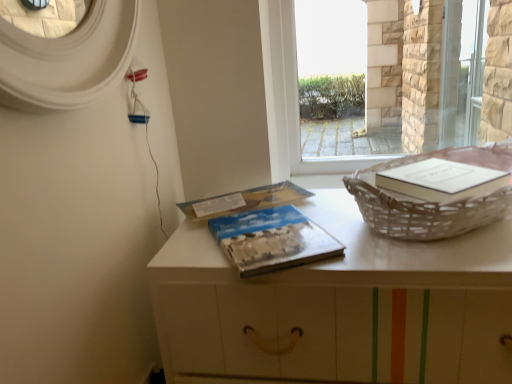
Locate an element on the screen. The width and height of the screenshot is (512, 384). blue matte paper at center, the 1th paperback book when ordered from back to front is located at coordinates (244, 201).

Describe the element at coordinates (340, 306) in the screenshot. I see `white matte table at center` at that location.

What do you see at coordinates (272, 240) in the screenshot?
I see `blue textured paper at center, marked as the second paperback book in a back-to-front arrangement` at bounding box center [272, 240].

The height and width of the screenshot is (384, 512). I want to click on woven wicker basket at right, so click(432, 203).

From the image's perspective, between blue textured paper at center, marked as the second paperback book in a back-to-front arrangement, and blue matte paper at center, which appears as the second paperback book when viewed from the front, which one is located above?

blue matte paper at center, which appears as the second paperback book when viewed from the front, appears higher in the image.

Visually, is blue textured paper at center, marked as the second paperback book in a back-to-front arrangement, positioned to the left or to the right of blue matte paper at center, the 1th paperback book when ordered from back to front?

In the image, blue textured paper at center, marked as the second paperback book in a back-to-front arrangement, appears on the right side of blue matte paper at center, the 1th paperback book when ordered from back to front.

Would you consider blue textured paper at center, marked as the second paperback book in a back-to-front arrangement, to be distant from blue matte paper at center, the 1th paperback book when ordered from back to front?

They are positioned close to each other.

Between blue textured paper at center, marked as the 1th paperback book in a front-to-back arrangement, and blue matte paper at center, which appears as the second paperback book when viewed from the front, which one has larger width?

blue textured paper at center, marked as the 1th paperback book in a front-to-back arrangement.

Based on the photo, which point is more distant from viewer, (413, 307) or (206, 213)?

The point (206, 213) is more distant.

From the image's perspective, is white matte table at center above or below blue matte paper at center, which appears as the second paperback book when viewed from the front?

white matte table at center is situated lower than blue matte paper at center, which appears as the second paperback book when viewed from the front, in the image.

Can you confirm if white matte table at center is taller than blue matte paper at center, the 1th paperback book when ordered from back to front?

Yes, white matte table at center is taller than blue matte paper at center, the 1th paperback book when ordered from back to front.

Looking at this image, would you say blue matte paper at center, the 1th paperback book when ordered from back to front, is part of white matte table at center's contents?

Yes, blue matte paper at center, the 1th paperback book when ordered from back to front, is a part of white matte table at center.

Consider the image. Is woven wicker basket at right in contact with transparent glass screen door at upper right?

No, woven wicker basket at right is not touching transparent glass screen door at upper right.

Is woven wicker basket at right looking in the opposite direction of transparent glass screen door at upper right?

Correct, woven wicker basket at right is looking away from transparent glass screen door at upper right.

From a real-world perspective, is woven wicker basket at right below transparent glass screen door at upper right?

Yes, from a real-world perspective, woven wicker basket at right is below transparent glass screen door at upper right.

Is blue textured paper at center, marked as the 1th paperback book in a front-to-back arrangement, not close to transparent glass window at center?

No, blue textured paper at center, marked as the 1th paperback book in a front-to-back arrangement, is in close proximity to transparent glass window at center.

What are the coordinates of `window behind the blue textured paper at center, marked as the second paperback book in a back-to-front arrangement` in the screenshot? It's located at (290, 99).

Does blue textured paper at center, marked as the second paperback book in a back-to-front arrangement, turn towards transparent glass window at center?

No, blue textured paper at center, marked as the second paperback book in a back-to-front arrangement, does not turn towards transparent glass window at center.

Considering the relative sizes of blue textured paper at center, marked as the 1th paperback book in a front-to-back arrangement, and transparent glass window at center in the image provided, is blue textured paper at center, marked as the 1th paperback book in a front-to-back arrangement, thinner than transparent glass window at center?

Incorrect, the width of blue textured paper at center, marked as the 1th paperback book in a front-to-back arrangement, is not less than that of transparent glass window at center.

Considering the sizes of objects blue textured paper at center, marked as the 1th paperback book in a front-to-back arrangement, and white matte table at center in the image provided, who is wider, blue textured paper at center, marked as the 1th paperback book in a front-to-back arrangement, or white matte table at center?

white matte table at center.

Based on the photo, how many degrees apart are the facing directions of blue textured paper at center, marked as the 1th paperback book in a front-to-back arrangement, and white matte table at center?

The angular difference between blue textured paper at center, marked as the 1th paperback book in a front-to-back arrangement, and white matte table at center is 32.7 degrees.

Is blue textured paper at center, marked as the second paperback book in a back-to-front arrangement, inside the boundaries of white matte table at center, or outside?

blue textured paper at center, marked as the second paperback book in a back-to-front arrangement, is spatially positioned inside white matte table at center.

How many degrees apart are the facing directions of blue textured paper at center, marked as the second paperback book in a back-to-front arrangement, and transparent glass screen door at upper right?

The angular difference between blue textured paper at center, marked as the second paperback book in a back-to-front arrangement, and transparent glass screen door at upper right is 33.8 degrees.

Considering the relative sizes of blue textured paper at center, marked as the 1th paperback book in a front-to-back arrangement, and transparent glass screen door at upper right in the image provided, is blue textured paper at center, marked as the 1th paperback book in a front-to-back arrangement, taller than transparent glass screen door at upper right?

In fact, blue textured paper at center, marked as the 1th paperback book in a front-to-back arrangement, may be shorter than transparent glass screen door at upper right.

This screenshot has width=512, height=384. I want to click on paperback book that is the 2nd one when counting downward from the transparent glass screen door at upper right (from the image's perspective), so click(x=272, y=240).

Between blue textured paper at center, marked as the second paperback book in a back-to-front arrangement, and transparent glass screen door at upper right, which one has larger size?

Bigger between the two is transparent glass screen door at upper right.

From the image's perspective, is woven wicker basket at right located beneath white matte table at center?

Incorrect, from the image's perspective, woven wicker basket at right is higher than white matte table at center.

Considering the positions of points (507, 193) and (502, 229), is point (507, 193) closer to camera compared to point (502, 229)?

Yes.

Does woven wicker basket at right appear on the left side of white matte table at center?

No, woven wicker basket at right is not to the left of white matte table at center.

Could you tell me if woven wicker basket at right is turned towards white matte table at center?

No.

At what (x,y) coordinates should I click in order to perform the action: click on paperback book in front of the blue matte paper at center, which appears as the second paperback book when viewed from the front. Please return your answer as a coordinate pair (x, y). The height and width of the screenshot is (384, 512). Looking at the image, I should click on (272, 240).

Where is `the 2nd paperback book above when counting from the white matte table at center (from the image's perspective)`? the 2nd paperback book above when counting from the white matte table at center (from the image's perspective) is located at coordinates (244, 201).

Based on their spatial positions, is white matte table at center or blue textured paper at center, marked as the second paperback book in a back-to-front arrangement, further from transparent glass window at center?

Among the two, white matte table at center is located further to transparent glass window at center.

Looking at the image, which one is located closer to transparent glass screen door at upper right, transparent glass window at center or blue textured paper at center, marked as the 1th paperback book in a front-to-back arrangement?

transparent glass window at center is positioned closer to the anchor transparent glass screen door at upper right.

When comparing their distances from white matte table at center, does blue matte paper at center, the 1th paperback book when ordered from back to front, or woven wicker basket at right seem further?

blue matte paper at center, the 1th paperback book when ordered from back to front, lies further to white matte table at center than the other object.

Which object lies nearer to the anchor point blue matte paper at center, the 1th paperback book when ordered from back to front, woven wicker basket at right or transparent glass screen door at upper right?

The object closer to blue matte paper at center, the 1th paperback book when ordered from back to front, is woven wicker basket at right.

From the image, which object appears to be farther from transparent glass window at center, white matte table at center or blue matte paper at center, which appears as the second paperback book when viewed from the front?

white matte table at center is further to transparent glass window at center.

Considering their positions, is white matte table at center positioned closer to transparent glass screen door at upper right than transparent glass window at center?

transparent glass window at center is positioned closer to the anchor transparent glass screen door at upper right.

Looking at the image, which one is located further to blue textured paper at center, marked as the 1th paperback book in a front-to-back arrangement, blue matte paper at center, the 1th paperback book when ordered from back to front, or transparent glass window at center?

transparent glass window at center is positioned further to the anchor blue textured paper at center, marked as the 1th paperback book in a front-to-back arrangement.

Looking at this image, when comparing their distances from transparent glass window at center, does woven wicker basket at right or transparent glass screen door at upper right seem further?

transparent glass screen door at upper right is further to transparent glass window at center.

Where is `paperback book between blue matte paper at center, the 1th paperback book when ordered from back to front, and white matte table at center in the up-down direction`? The image size is (512, 384). paperback book between blue matte paper at center, the 1th paperback book when ordered from back to front, and white matte table at center in the up-down direction is located at coordinates (272, 240).

Locate an element on the screen. Image resolution: width=512 pixels, height=384 pixels. window located between white matte table at center and transparent glass screen door at upper right in the depth direction is located at coordinates (290, 99).

In order to click on paperback book situated between blue matte paper at center, the 1th paperback book when ordered from back to front, and woven wicker basket at right from left to right in this screenshot , I will do `click(272, 240)`.

At what (x,y) coordinates should I click in order to perform the action: click on basket container that lies between transparent glass window at center and white matte table at center from top to bottom. Please return your answer as a coordinate pair (x, y). Looking at the image, I should click on (432, 203).